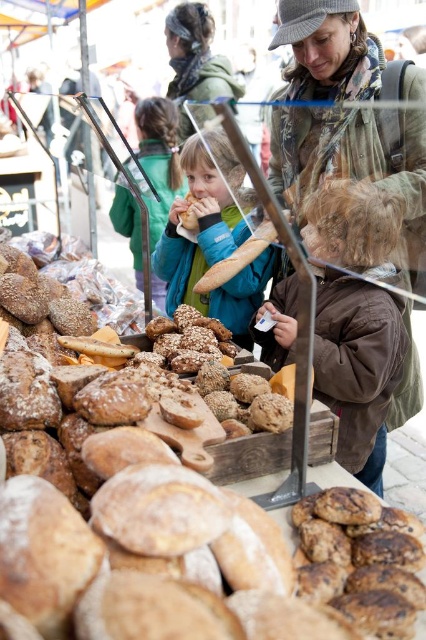
Question: Considering the relative positions of blue denim jacket at center and slightly toasted bread at center in the image provided, where is blue denim jacket at center located with respect to slightly toasted bread at center?

Choices:
 (A) right
 (B) left

Answer: (A)

Question: Where is camouflage jacket at center located in relation to blue fleece jacket at center in the image?

Choices:
 (A) below
 (B) above

Answer: (A)

Question: Can you confirm if blue fleece jacket at center is wider than slightly toasted bread at center?

Choices:
 (A) no
 (B) yes

Answer: (B)

Question: Which of the following is the closest to the observer?

Choices:
 (A) (146, 145)
 (B) (406, 394)
 (C) (198, 225)

Answer: (B)

Question: Which point is farther from the camera taking this photo?

Choices:
 (A) tap(189, 212)
 (B) tap(396, 132)
 (C) tap(154, 132)

Answer: (C)

Question: Which point is farther from the camera taking this photo?

Choices:
 (A) (221, 216)
 (B) (172, 124)
 (C) (192, 214)

Answer: (B)